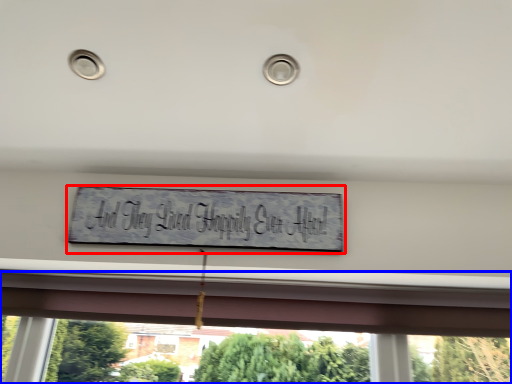
Question: Which object appears farthest to the camera in this image, sign (highlighted by a red box) or window (highlighted by a blue box)?

Choices:
 (A) sign
 (B) window

Answer: (B)